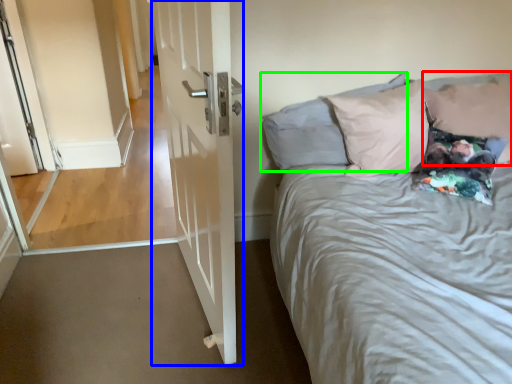
Question: Based on their relative distances, which object is farther from pillow (highlighted by a red box)? Choose from door (highlighted by a blue box) and pillow (highlighted by a green box).

Choices:
 (A) door
 (B) pillow

Answer: (A)